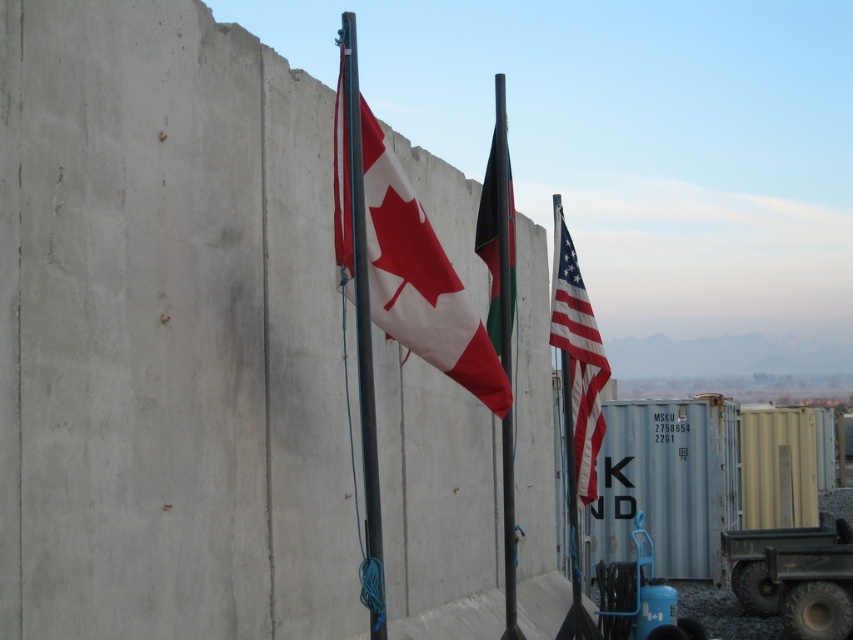
Is the position of green rubber trailer truck at lower right less distant than that of metallic pole at center?

No.

Can you confirm if green rubber trailer truck at lower right is bigger than metallic pole at center?

Yes.

Locate an element on the screen. This screenshot has width=853, height=640. green rubber trailer truck at lower right is located at coordinates coord(795,576).

Does rusty metal shipping container at center have a larger size compared to red-white striped fabric flag at center?

Indeed, rusty metal shipping container at center has a larger size compared to red-white striped fabric flag at center.

Is rusty metal shipping container at center shorter than red-white striped fabric flag at center?

No, rusty metal shipping container at center is not shorter than red-white striped fabric flag at center.

The height and width of the screenshot is (640, 853). In order to click on rusty metal shipping container at center in this screenshot , I will do `click(668, 483)`.

Image resolution: width=853 pixels, height=640 pixels. I want to click on rusty metal shipping container at center, so click(x=668, y=483).

In the scene shown: Who is more forward, [367,148] or [554,308]?

Point [367,148] is in front.

Is point (476, 385) closer to camera compared to point (563, 342)?

That is True.

The height and width of the screenshot is (640, 853). Identify the location of matte fabric flag at center. (421, 280).